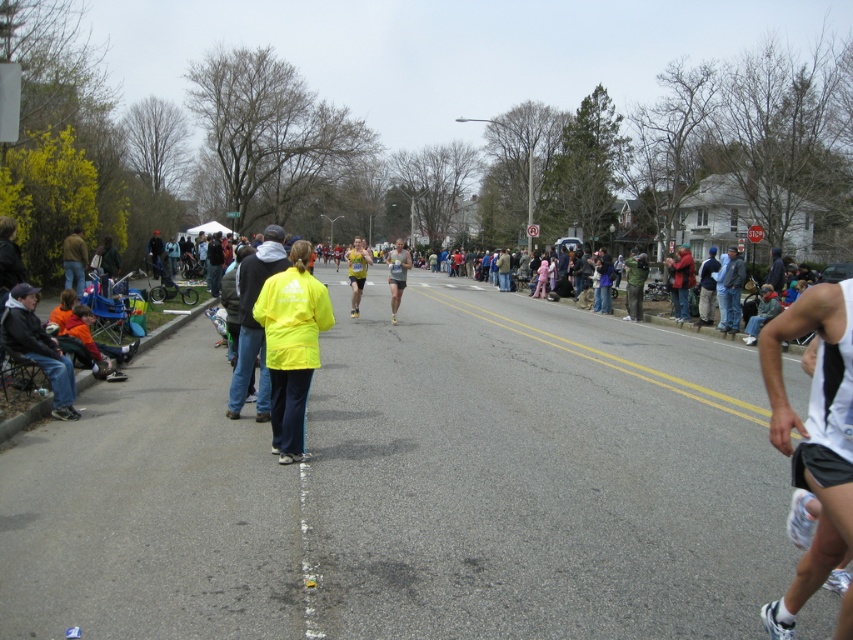
Is neon yellow jacket at center to the right of jeans at left from the viewer's perspective?

Indeed, neon yellow jacket at center is positioned on the right side of jeans at left.

How distant is neon yellow jacket at center from jeans at left?

neon yellow jacket at center is 37.68 feet from jeans at left.

At what (x,y) coordinates should I click in order to perform the action: click on neon yellow jacket at center. Please return your answer as a coordinate pair (x, y). The height and width of the screenshot is (640, 853). Looking at the image, I should click on (291, 346).

Who is lower down, neon yellow jacket at center or yellow matte jacket at center?

Positioned lower is neon yellow jacket at center.

Which is in front, point (268, 365) or point (250, 276)?

Positioned in front is point (268, 365).

Who is more distant from viewer, (306, 333) or (244, 310)?

Positioned behind is point (244, 310).

Locate an element on the screen. This screenshot has width=853, height=640. neon yellow jacket at center is located at coordinates (291, 346).

Is point (310, 340) less distant than point (33, 328)?

Yes, point (310, 340) is closer to viewer.

Does neon yellow jacket at center appear over dark blue denim jacket at lower left?

Correct, neon yellow jacket at center is located above dark blue denim jacket at lower left.

Between point (285, 296) and point (67, 381), which one is positioned in front?

Point (285, 296)

You are a GUI agent. You are given a task and a screenshot of the screen. Output one action in this format:
    pyautogui.click(x=<x>, y=<y>)
    Task: Click on the neon yellow jacket at center
    The height and width of the screenshot is (640, 853).
    Given the screenshot: What is the action you would take?
    [x=291, y=346]